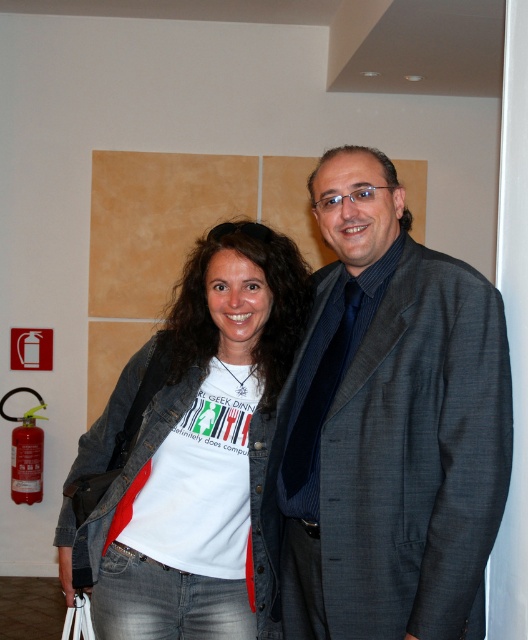
Question: Does dark gray suit at center lie in front of white cotton t-shirt at center?

Choices:
 (A) yes
 (B) no

Answer: (A)

Question: Which point is farther to the camera?

Choices:
 (A) (438, 497)
 (B) (275, 374)

Answer: (B)

Question: Which point is farther to the camera?

Choices:
 (A) white cotton t-shirt at center
 (B) dark gray suit at center

Answer: (A)

Question: Which of the following is the closest to the observer?

Choices:
 (A) dark gray suit at center
 (B) white cotton t-shirt at center

Answer: (A)

Question: Is dark gray suit at center positioned before white cotton t-shirt at center?

Choices:
 (A) yes
 (B) no

Answer: (A)

Question: Is the position of dark gray suit at center less distant than that of white cotton t-shirt at center?

Choices:
 (A) yes
 (B) no

Answer: (A)